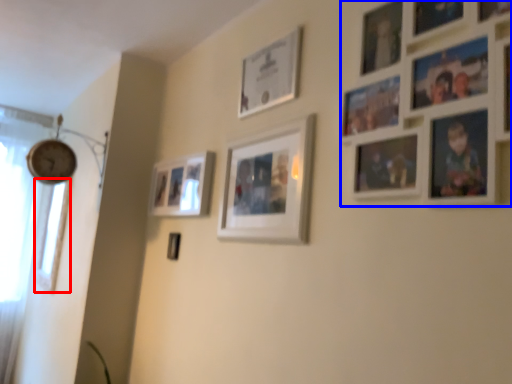
Question: Among these objects, which one is nearest to the camera, window (highlighted by a red box) or picture frame (highlighted by a blue box)?

Choices:
 (A) window
 (B) picture frame

Answer: (B)